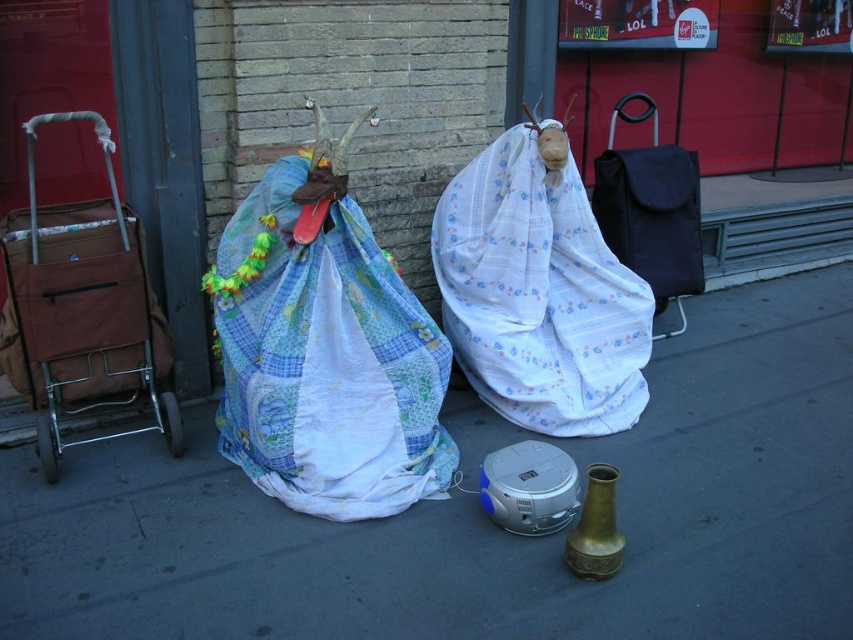
Does patchwork fabric bag at center-left appear on the right side of white floral fabric at center?

Incorrect, patchwork fabric bag at center-left is not on the right side of white floral fabric at center.

Is point (338, 472) in front of point (561, 433)?

Yes, it is in front of point (561, 433).

Between point (384, 401) and point (506, 275), which one is positioned behind?

Positioned behind is point (506, 275).

The height and width of the screenshot is (640, 853). I want to click on patchwork fabric bag at center-left, so click(325, 360).

Does smooth concrete pavement at center lie in front of white floral fabric at center?

Yes, it is.

Who is more distant from viewer, (x=315, y=532) or (x=495, y=211)?

Point (x=495, y=211)

This screenshot has width=853, height=640. In order to click on smooth concrete pavement at center in this screenshot , I will do `click(485, 516)`.

Is point (136, 406) closer to viewer compared to point (682, 278)?

Yes, it is.

Who is positioned more to the left, brown fabric cart at left or black fabric bag at center?

brown fabric cart at left is more to the left.

Identify the location of brown fabric cart at left. (83, 310).